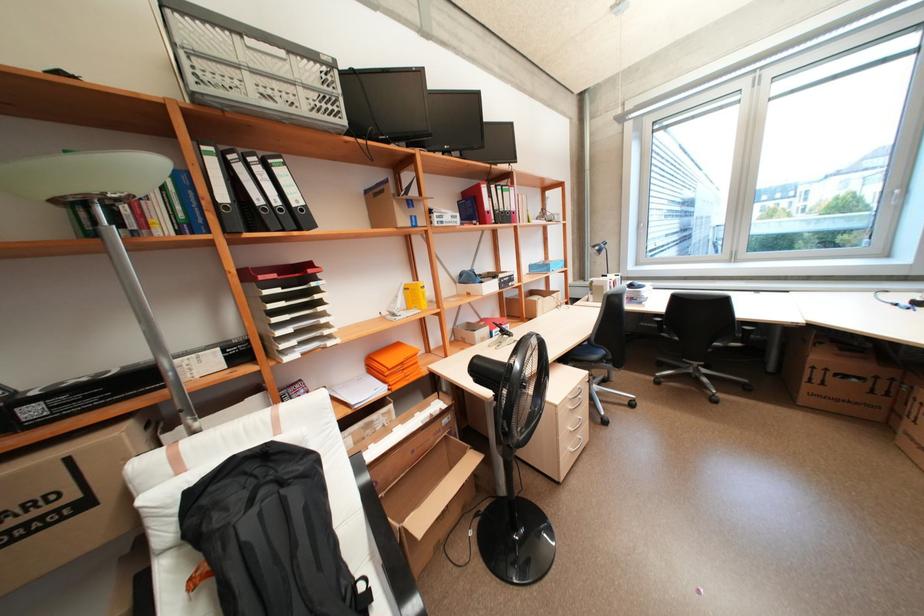
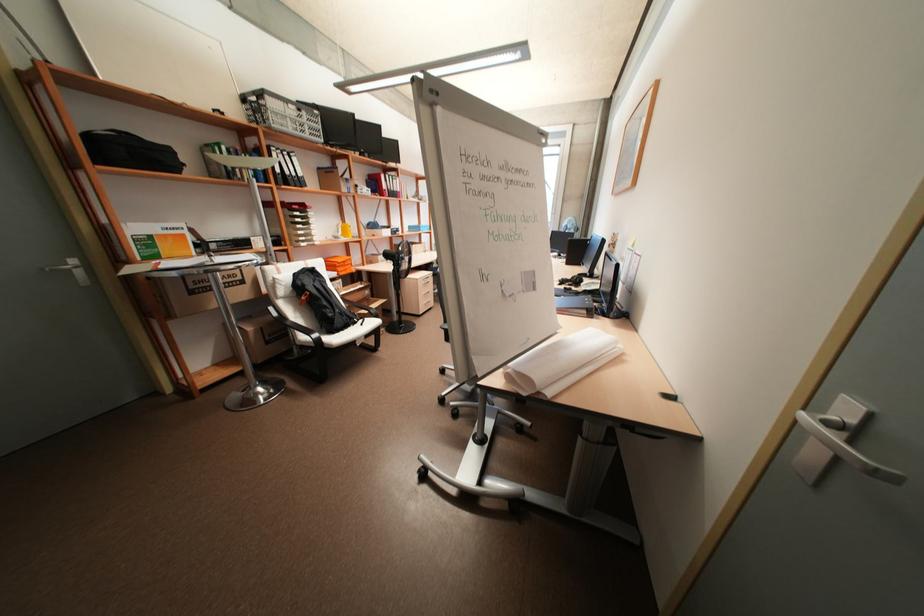
In the second image, find the point that corresponds to [516,293] in the first image.

(403, 240)